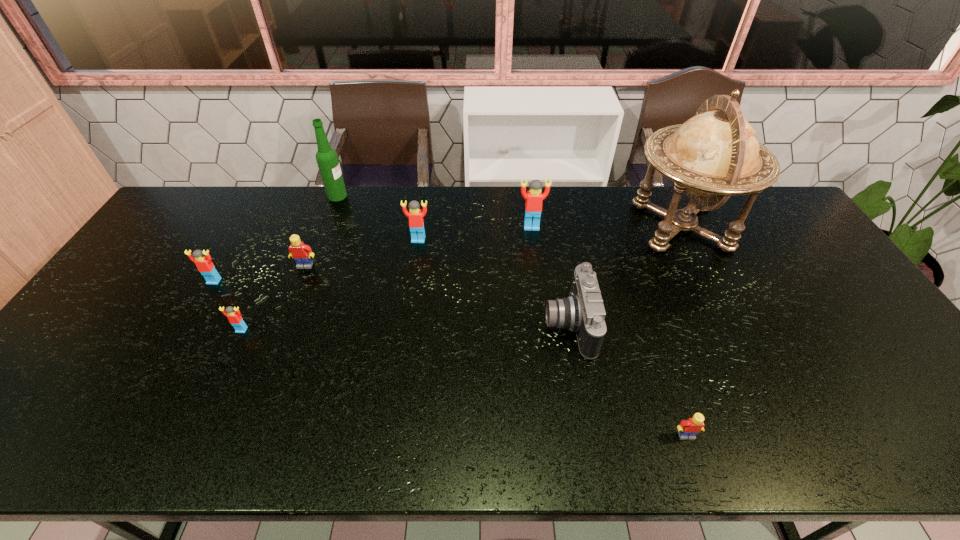
The image size is (960, 540). In order to click on vacant space located on the label of the eighth shortest object in this screenshot , I will do `click(422, 196)`.

At what (x,y) coordinates should I click in order to perform the action: click on vacant space located 0.210m on the face of the fifth Lego from left to right. Please return your answer as a coordinate pair (x, y). Looking at the image, I should click on [x=538, y=276].

Identify the location of vacant space situated on the face of the fifth object from right to left. (413, 277).

Identify the location of free space located on the front-facing side of the black camera. This screenshot has height=540, width=960. click(x=448, y=325).

Identify the location of blank space located on the front-facing side of the black camera. (508, 325).

Identify the location of vacant position located on the front-facing side of the black camera. The image size is (960, 540). (496, 325).

Locate an element on the screen. vacant space situated 0.150m on the face of the leftmost red Lego is located at coordinates (188, 326).

You are a GUI agent. You are given a task and a screenshot of the screen. Output one action in this format:
    pyautogui.click(x=<x>, y=<y>)
    Task: Click on the vacant area located 0.180m on the front-facing side of the left yellow Lego
    The image size is (960, 540).
    Given the screenshot: What is the action you would take?
    pyautogui.click(x=286, y=315)

The height and width of the screenshot is (540, 960). What are the coordinates of `vacant space situated 0.120m on the face of the smallest red Lego` in the screenshot? It's located at (222, 373).

Find the location of a particular element. The width and height of the screenshot is (960, 540). globe present at the far edge is located at coordinates (715, 154).